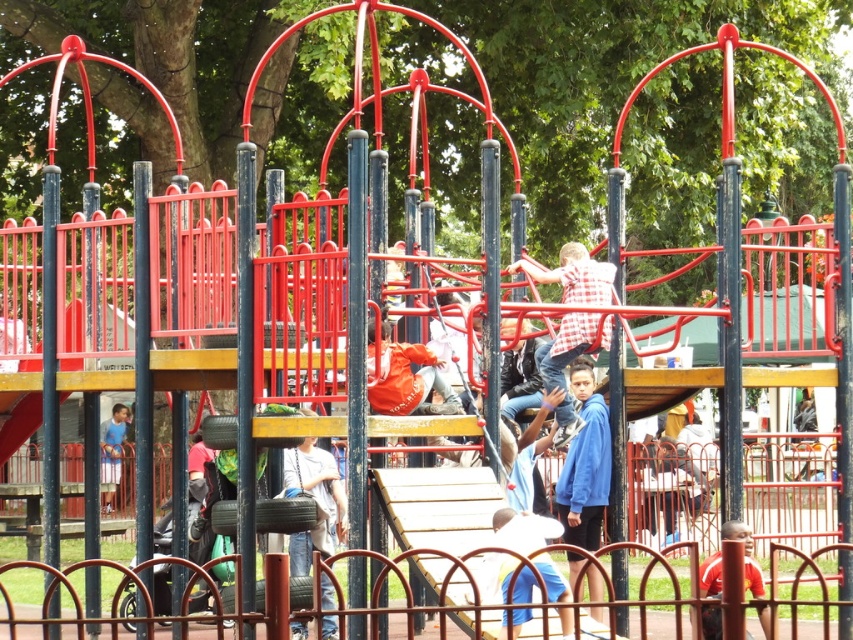
Question: Which point is farther to the camera?

Choices:
 (A) blue fabric shirt at center
 (B) checkered fabric shirt at center
 (C) white cotton shirt at center

Answer: (A)

Question: Is checkered fabric shirt at center behind blue fabric shirt at center?

Choices:
 (A) no
 (B) yes

Answer: (A)

Question: Can you confirm if white cotton shirt at lower center is positioned to the right of blue fabric shirt at center?

Choices:
 (A) yes
 (B) no

Answer: (A)

Question: Which of these objects is positioned closest to the checkered fabric shirt at center?

Choices:
 (A) white cotton shirt at center
 (B) blue fleece jacket at lower right
 (C) white cotton shirt at lower center
 (D) blue fabric shirt at center

Answer: (B)

Question: Which point is closer to the camera taking this photo?

Choices:
 (A) (107, 436)
 (B) (590, 440)
 (C) (567, 342)
 (D) (315, 476)

Answer: (C)

Question: Is blue fleece jacket at lower right further to camera compared to white cotton shirt at lower center?

Choices:
 (A) yes
 (B) no

Answer: (B)